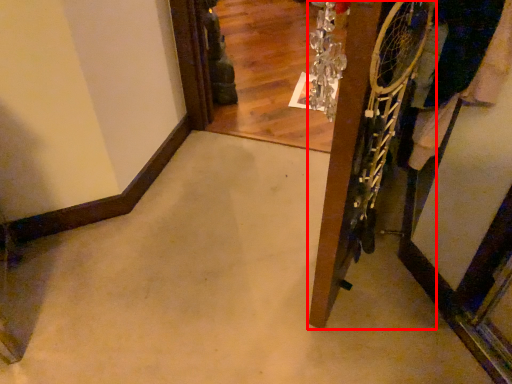
Question: From the image's perspective, what is the correct spatial relationship of door (annotated by the red box) in relation to clothing?

Choices:
 (A) above
 (B) below

Answer: (B)